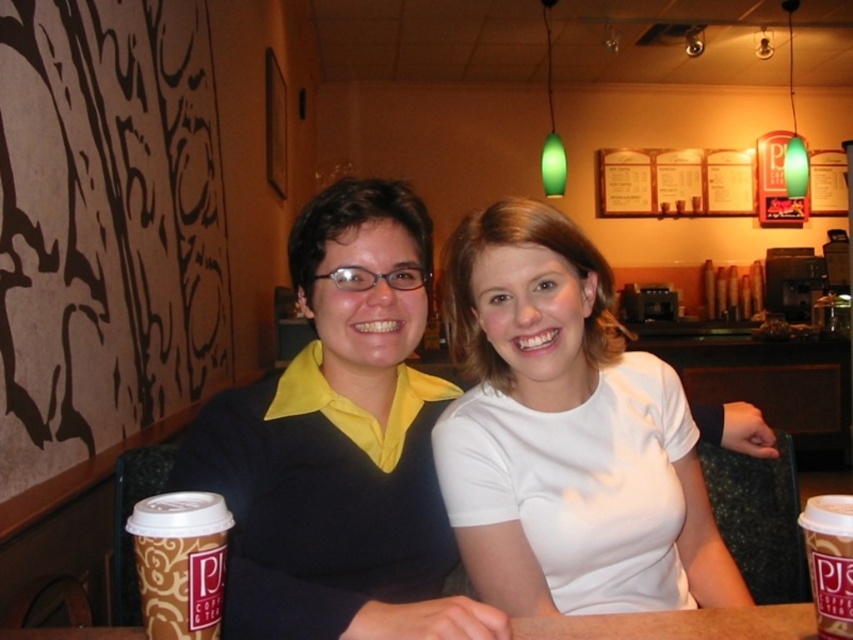
Question: Which point is farther from the camera taking this photo?

Choices:
 (A) (271, 467)
 (B) (672, 616)
 (C) (840, 540)

Answer: (A)

Question: Estimate the real-world distances between objects in this image. Which object is farther from the white matte shirt at center?

Choices:
 (A) brown wooden table at center
 (B) black matte shirt at center

Answer: (A)

Question: Observing the image, what is the correct spatial positioning of black matte shirt at center in reference to brown wooden table at center?

Choices:
 (A) right
 (B) left

Answer: (B)

Question: Is white matte shirt at center closer to the viewer compared to brown wooden table at center?

Choices:
 (A) yes
 (B) no

Answer: (B)

Question: Among these points, which one is farthest from the camera?

Choices:
 (A) (199, 528)
 (B) (267, 419)
 (C) (703, 636)

Answer: (B)

Question: In this image, where is brown paper cup at lower left located relative to brown paper cup at lower right?

Choices:
 (A) above
 (B) below

Answer: (A)